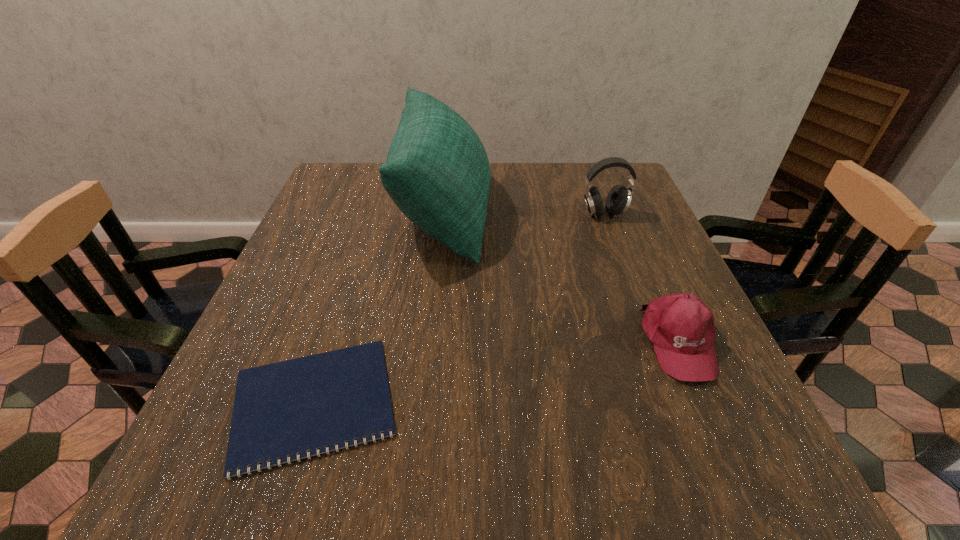
Find the location of a particular element. This screenshot has width=960, height=540. empty location between the tallest object and the third tallest object is located at coordinates (562, 277).

Find the location of a particular element. The image size is (960, 540). blank region between the shortest object and the second tallest object is located at coordinates (459, 308).

Identify the location of vacant area that lies between the second tallest object and the shortest object. The width and height of the screenshot is (960, 540). (459, 308).

Where is `unoccupied area between the second shortest object and the tallest object`? The width and height of the screenshot is (960, 540). unoccupied area between the second shortest object and the tallest object is located at coordinates (562, 277).

Identify the location of the third closest object to the baseball cap. (288, 408).

Image resolution: width=960 pixels, height=540 pixels. In order to click on object that is the closest to the notepad in this screenshot , I will do `click(437, 172)`.